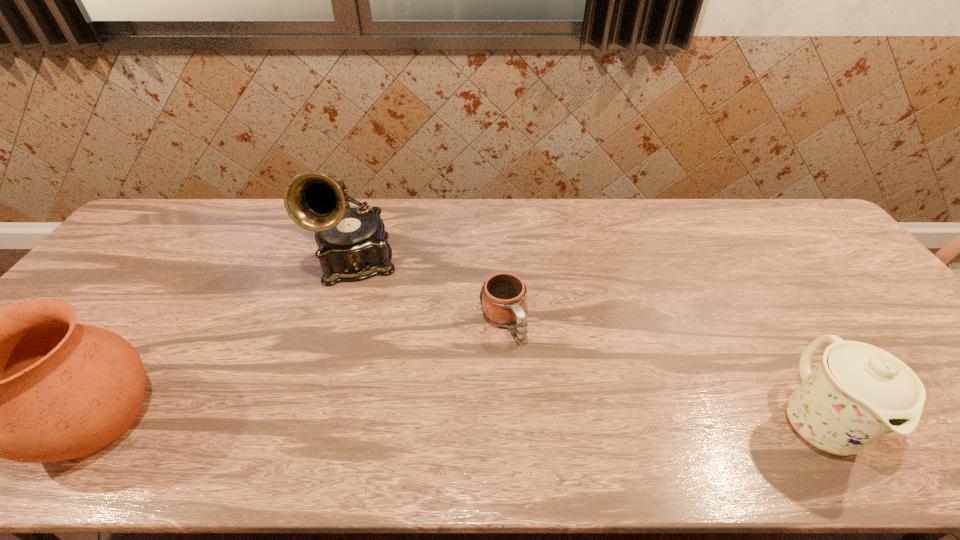
Find the location of a particular element. the third tallest object is located at coordinates click(857, 394).

At what (x,y) coordinates should I click in order to perform the action: click on chinaware. Please return your answer as a coordinate pair (x, y). Looking at the image, I should click on (857, 394).

At what (x,y) coordinates should I click in order to perform the action: click on the shortest object. Please return your answer as a coordinate pair (x, y). Looking at the image, I should click on (503, 296).

This screenshot has height=540, width=960. I want to click on the second farthest object, so click(503, 296).

Image resolution: width=960 pixels, height=540 pixels. Identify the location of the tallest object. (352, 245).

At what (x,y) coordinates should I click in order to perform the action: click on phonograph record. Please return your answer as a coordinate pair (x, y). Looking at the image, I should click on (352, 245).

Image resolution: width=960 pixels, height=540 pixels. In order to click on vacant space located 0.050m on the side of the mug with the handle in this screenshot , I will do [x=521, y=362].

You are a GUI agent. You are given a task and a screenshot of the screen. Output one action in this format:
    pyautogui.click(x=<x>, y=<y>)
    Task: Click on the free spot located 0.150m on the side of the mug with the handle
    
    Given the screenshot: What is the action you would take?
    pyautogui.click(x=540, y=396)

At what (x,y) coordinates should I click in order to perform the action: click on vacant area located on the horn of the second object from left to right. Please return your answer as a coordinate pair (x, y). Image resolution: width=960 pixels, height=540 pixels. Looking at the image, I should click on (360, 318).

The width and height of the screenshot is (960, 540). Identify the location of free region located on the horn of the second object from left to right. (360, 309).